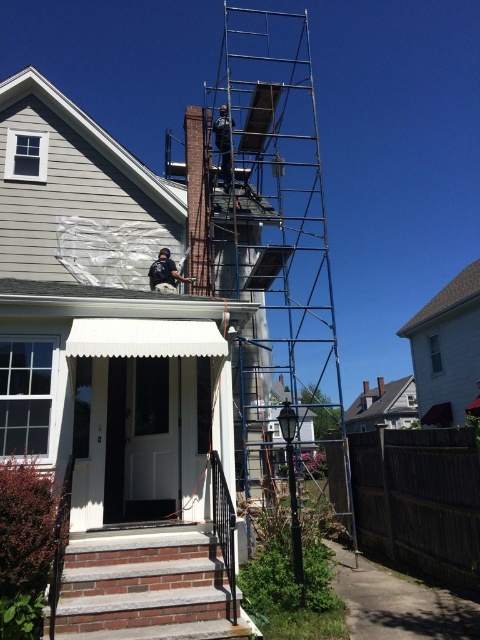
Does metallic scaffolding at center have a smaller size compared to black fabric construction worker at center?

Incorrect, metallic scaffolding at center is not smaller in size than black fabric construction worker at center.

From the picture: Can you confirm if metallic scaffolding at center is bigger than black fabric construction worker at center?

Yes.

Who is more distant from viewer, (240,68) or (156,285)?

Positioned behind is point (240,68).

Locate an element on the screen. metallic scaffolding at center is located at coordinates (277, 250).

Who is more distant from viewer, [83,592] or [169,272]?

Positioned behind is point [169,272].

Does point (116, 552) come closer to viewer compared to point (165, 272)?

Yes.

Locate an element on the screen. brick stairs at lower left is located at coordinates (145, 588).

Based on the photo, between metallic scaffolding at center and brick stairs at lower left, which one has less height?

brick stairs at lower left

This screenshot has width=480, height=640. What do you see at coordinates (277, 250) in the screenshot? I see `metallic scaffolding at center` at bounding box center [277, 250].

Between point (266, 54) and point (199, 544), which one is positioned behind?

Point (266, 54)

Where is `metallic scaffolding at center`? This screenshot has width=480, height=640. metallic scaffolding at center is located at coordinates (277, 250).